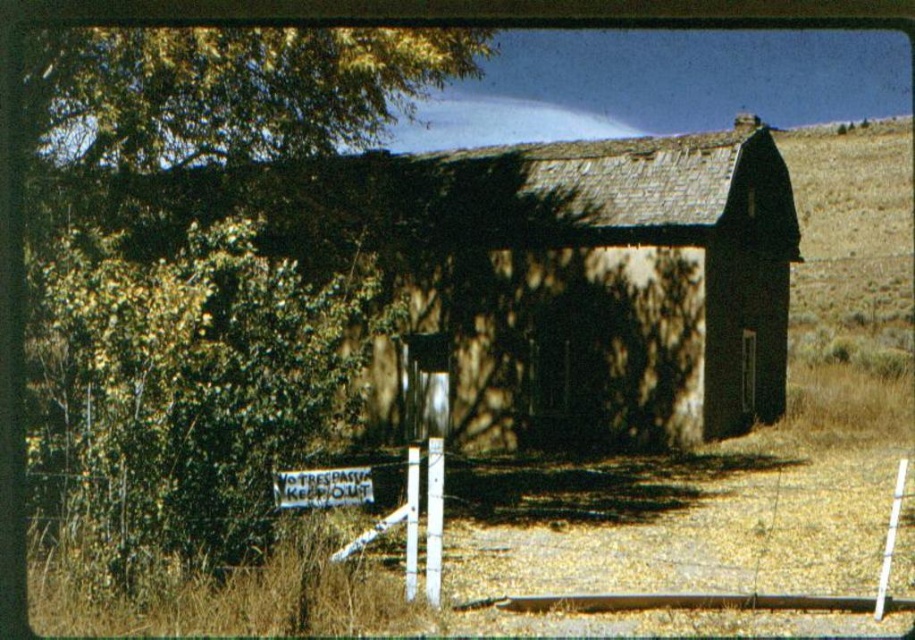
You are a farmer checking the perimeter of your property. You see the dark brown stone barn at center and the white wire fence at lower left. Which object is closer to you as you stand at the entrance of the property?

The dark brown stone barn at center is closer to you because the white wire fence at lower left is behind it, meaning the barn is in front.

You are standing in front of the old barn and notice a specific point marked at coordinates (680, 525). Based on the scene description, can you identify what object this point is pointing to?

The point at coordinates (680, 525) corresponds to the white wire fence at lower center.